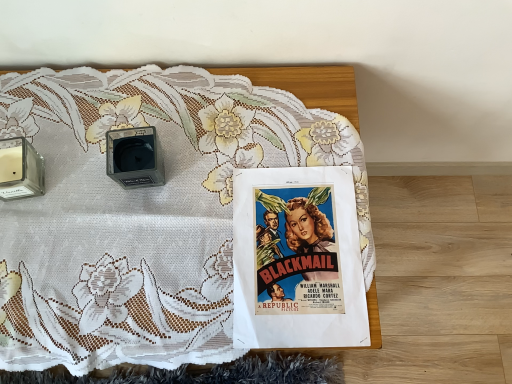
In order to click on matte paper poster at center in this screenshot , I will do `click(297, 259)`.

Identify the location of white lace tablecloth at upper center. The height and width of the screenshot is (384, 512). (151, 206).

In order to face white lace tablecloth at upper center, should I rotate leftwards or rightwards?

Rotate your view left by about 10.879°.

Measure the distance between matte black speaker at center, placed as the 1th speaker when sorted from right to left, and camera.

They are 27.49 inches apart.

Locate an element on the screen. transparent glass candle at left, positioned as the 2th speaker in right-to-left order is located at coordinates (20, 170).

This screenshot has width=512, height=384. In order to click on matte paper poster at center in this screenshot , I will do `click(297, 259)`.

In terms of width, does transparent glass candle at left, positioned as the 2th speaker in right-to-left order, look wider or thinner when compared to matte paper poster at center?

Clearly, transparent glass candle at left, positioned as the 2th speaker in right-to-left order, has less width compared to matte paper poster at center.

Considering the relative sizes of transparent glass candle at left, positioned as the 2th speaker in right-to-left order, and matte paper poster at center in the image provided, is transparent glass candle at left, positioned as the 2th speaker in right-to-left order, smaller than matte paper poster at center?

Actually, transparent glass candle at left, positioned as the 2th speaker in right-to-left order, might be larger than matte paper poster at center.

From the image's perspective, is transparent glass candle at left, acting as the first speaker starting from the left, positioned above or below matte paper poster at center?

transparent glass candle at left, acting as the first speaker starting from the left, is situated higher than matte paper poster at center in the image.

Is point (36, 171) positioned before point (274, 263)?

No, it is behind (274, 263).

From the image's perspective, does matte paper poster at center appear higher than transparent glass candle at left, acting as the first speaker starting from the left?

No.

Which of these two, matte paper poster at center or transparent glass candle at left, acting as the first speaker starting from the left, stands taller?

transparent glass candle at left, acting as the first speaker starting from the left.

Considering the positions of point (354, 313) and point (25, 185), is point (354, 313) closer or farther from the camera than point (25, 185)?

Point (354, 313).

From the picture: From the image's perspective, which one is positioned higher, matte paper poster at center or matte black speaker at center, placed as the 1th speaker when sorted from right to left?

matte black speaker at center, placed as the 1th speaker when sorted from right to left.

Considering the relative sizes of matte paper poster at center and matte black speaker at center, positioned as the 2th speaker in left-to-right order, in the image provided, is matte paper poster at center shorter than matte black speaker at center, positioned as the 2th speaker in left-to-right order,?

Yes, matte paper poster at center is shorter than matte black speaker at center, positioned as the 2th speaker in left-to-right order.

Is matte paper poster at center turned away from matte black speaker at center, placed as the 1th speaker when sorted from right to left?

matte paper poster at center does not have its back to matte black speaker at center, placed as the 1th speaker when sorted from right to left.

Can you see matte paper poster at center touching matte black speaker at center, placed as the 1th speaker when sorted from right to left?

matte paper poster at center is not next to matte black speaker at center, placed as the 1th speaker when sorted from right to left, and they're not touching.

How different are the orientations of matte paper poster at center and white lace tablecloth at upper center in degrees?

1.98 degrees separate the facing orientations of matte paper poster at center and white lace tablecloth at upper center.

From the image's perspective, between matte paper poster at center and white lace tablecloth at upper center, which one is located above?

white lace tablecloth at upper center, from the image's perspective.

Is white lace tablecloth at upper center at the back of matte paper poster at center?

Yes, matte paper poster at center's orientation is away from white lace tablecloth at upper center.

Is matte black speaker at center, positioned as the 2th speaker in left-to-right order, looking in the opposite direction of transparent glass candle at left, positioned as the 2th speaker in right-to-left order?

matte black speaker at center, positioned as the 2th speaker in left-to-right order, is not turned away from transparent glass candle at left, positioned as the 2th speaker in right-to-left order.

Can you tell me how much matte black speaker at center, positioned as the 2th speaker in left-to-right order, and transparent glass candle at left, positioned as the 2th speaker in right-to-left order, differ in facing direction?

12.9 degrees separate the facing orientations of matte black speaker at center, positioned as the 2th speaker in left-to-right order, and transparent glass candle at left, positioned as the 2th speaker in right-to-left order.

Which of these two, matte black speaker at center, positioned as the 2th speaker in left-to-right order, or transparent glass candle at left, positioned as the 2th speaker in right-to-left order, is bigger?

With larger size is matte black speaker at center, positioned as the 2th speaker in left-to-right order.

Between transparent glass candle at left, acting as the first speaker starting from the left, and white lace tablecloth at upper center, which one is positioned behind?

transparent glass candle at left, acting as the first speaker starting from the left, is further from the camera.

Considering the sizes of transparent glass candle at left, positioned as the 2th speaker in right-to-left order, and white lace tablecloth at upper center in the image, is transparent glass candle at left, positioned as the 2th speaker in right-to-left order, wider or thinner than white lace tablecloth at upper center?

transparent glass candle at left, positioned as the 2th speaker in right-to-left order, is thinner than white lace tablecloth at upper center.

Considering the positions of objects transparent glass candle at left, acting as the first speaker starting from the left, and white lace tablecloth at upper center in the image provided, who is more to the right, transparent glass candle at left, acting as the first speaker starting from the left, or white lace tablecloth at upper center?

white lace tablecloth at upper center is more to the right.

Between matte black speaker at center, positioned as the 2th speaker in left-to-right order, and matte paper poster at center, which one is positioned behind?

matte black speaker at center, positioned as the 2th speaker in left-to-right order.

Is matte black speaker at center, placed as the 1th speaker when sorted from right to left, not within matte paper poster at center?

Yes.

From the picture: Considering the relative sizes of matte black speaker at center, positioned as the 2th speaker in left-to-right order, and matte paper poster at center in the image provided, is matte black speaker at center, positioned as the 2th speaker in left-to-right order, taller than matte paper poster at center?

Yes.

Looking at their sizes, would you say matte black speaker at center, positioned as the 2th speaker in left-to-right order, is wider or thinner than matte paper poster at center?

Clearly, matte black speaker at center, positioned as the 2th speaker in left-to-right order, has less width compared to matte paper poster at center.

From the image's perspective, starting from the matte paper poster at center, which speaker is the 1st one above? Please provide its 2D coordinates.

[(20, 170)]

This screenshot has width=512, height=384. Find the location of `comic book to the right of transparent glass candle at left, acting as the first speaker starting from the left`. comic book to the right of transparent glass candle at left, acting as the first speaker starting from the left is located at coordinates (297, 259).

From the image, which object appears to be farther from white lace tablecloth at upper center, matte black speaker at center, placed as the 1th speaker when sorted from right to left, or transparent glass candle at left, acting as the first speaker starting from the left?

transparent glass candle at left, acting as the first speaker starting from the left, lies further to white lace tablecloth at upper center than the other object.

From the image, which object appears to be nearer to matte paper poster at center, matte black speaker at center, positioned as the 2th speaker in left-to-right order, or transparent glass candle at left, acting as the first speaker starting from the left?

matte black speaker at center, positioned as the 2th speaker in left-to-right order, is closer to matte paper poster at center.

Estimate the real-world distances between objects in this image. Which object is further from matte paper poster at center, white lace tablecloth at upper center or transparent glass candle at left, acting as the first speaker starting from the left?

Among the two, transparent glass candle at left, acting as the first speaker starting from the left, is located further to matte paper poster at center.

Which object lies further to the anchor point matte paper poster at center, transparent glass candle at left, positioned as the 2th speaker in right-to-left order, or white lace tablecloth at upper center?

transparent glass candle at left, positioned as the 2th speaker in right-to-left order.

When comparing their distances from white lace tablecloth at upper center, does transparent glass candle at left, positioned as the 2th speaker in right-to-left order, or matte paper poster at center seem further?

Among the two, transparent glass candle at left, positioned as the 2th speaker in right-to-left order, is located further to white lace tablecloth at upper center.

From the image, which object appears to be farther from transparent glass candle at left, acting as the first speaker starting from the left, white lace tablecloth at upper center or matte paper poster at center?

Based on the image, matte paper poster at center appears to be further to transparent glass candle at left, acting as the first speaker starting from the left.

When comparing their distances from matte paper poster at center, does white lace tablecloth at upper center or matte black speaker at center, placed as the 1th speaker when sorted from right to left, seem closer?

white lace tablecloth at upper center lies closer to matte paper poster at center than the other object.

Considering their positions, is matte black speaker at center, positioned as the 2th speaker in left-to-right order, positioned closer to matte paper poster at center than white lace tablecloth at upper center?

Among the two, white lace tablecloth at upper center is located nearer to matte paper poster at center.

Where is `bed situated between matte black speaker at center, positioned as the 2th speaker in left-to-right order, and matte paper poster at center from left to right`? bed situated between matte black speaker at center, positioned as the 2th speaker in left-to-right order, and matte paper poster at center from left to right is located at coordinates (151, 206).

The image size is (512, 384). In order to click on speaker between transparent glass candle at left, positioned as the 2th speaker in right-to-left order, and matte paper poster at center from left to right in this screenshot , I will do `click(134, 157)`.

At what (x,y) coordinates should I click in order to perform the action: click on speaker located between transparent glass candle at left, positioned as the 2th speaker in right-to-left order, and white lace tablecloth at upper center in the left-right direction. Please return your answer as a coordinate pair (x, y). Looking at the image, I should click on (134, 157).

What are the coordinates of `bed between transparent glass candle at left, positioned as the 2th speaker in right-to-left order, and matte paper poster at center, in the horizontal direction` in the screenshot? It's located at (151, 206).